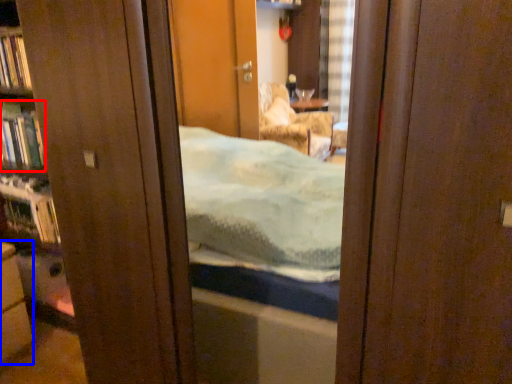
Question: Which point is closer to the camera, book (highlighted by a red box) or cabinetry (highlighted by a blue box)?

Choices:
 (A) book
 (B) cabinetry

Answer: (B)